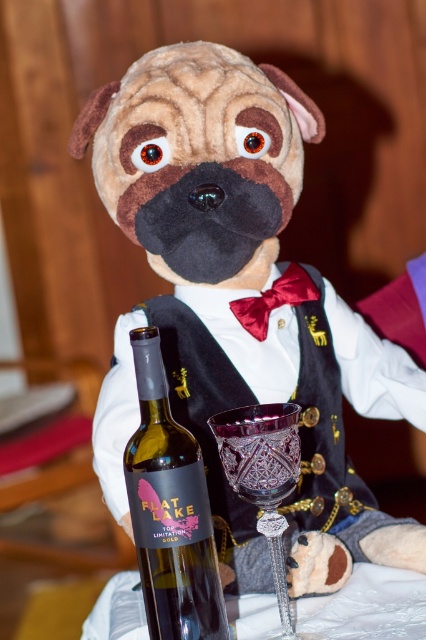
From the picture: You are a photographer trying to capture both the brown plush dog at center and the translucent glass bottle at center in a single frame. Based on their sizes, which object should you position closer to the camera to ensure both fit within the frame?

The brown plush dog at center is wider than the translucent glass bottle at center. To fit both in the frame, position the brown plush dog at center closer to the camera since its larger size requires more space, while the smaller translucent glass bottle at center can be placed slightly farther back to balance the composition.

What are the coordinates of the brown plush dog at center?

The brown plush dog at center is located at point (241, 305).

You are a photographer standing at a distance. You want to take a closeup photo of the brown plush dog at center. The camera you are using has a minimum focusing distance of 50 centimeters. Can you take the photo without moving closer?

The brown plush dog at center is 64.84 centimeters away from camera. Since the minimum focusing distance is 50 centimeters, the camera can focus on the brown plush dog at center as it is beyond the minimum distance. Therefore, you can take the closeup photo without moving closer.